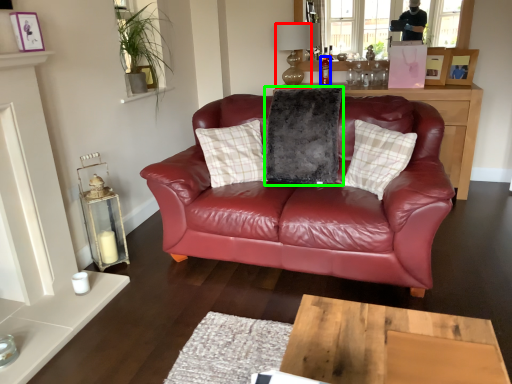
Question: Considering the real-world distances, which object is farthest from lamp (highlighted by a red box)? bottle (highlighted by a blue box) or pillow (highlighted by a green box)?

Choices:
 (A) bottle
 (B) pillow

Answer: (B)